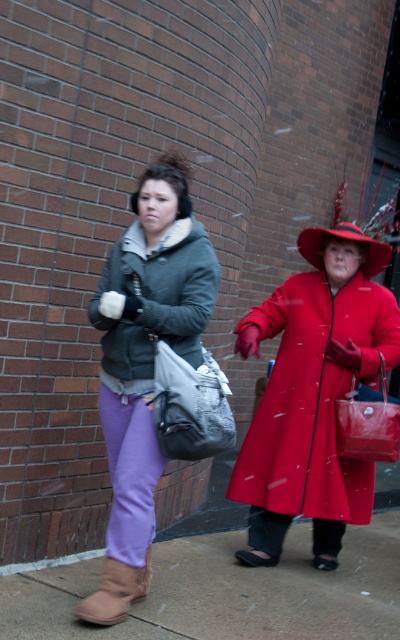
Question: Where is brown concrete sidewalk at lower center located in relation to matte red coat at center in the image?

Choices:
 (A) right
 (B) left

Answer: (B)

Question: Among these points, which one is nearest to the camera?

Choices:
 (A) (306, 253)
 (B) (146, 397)
 (C) (112, 570)
 (D) (381, 451)

Answer: (C)

Question: Which object is farther from the camera taking this photo?

Choices:
 (A) matte gray coat at center
 (B) matte gray jacket at center
 (C) brown concrete sidewalk at lower center
 (D) gray fabric shopping bag at center

Answer: (A)

Question: Can you confirm if gray fabric shopping bag at center is positioned to the left of red felt hat at center?

Choices:
 (A) yes
 (B) no

Answer: (A)

Question: Which of the following is the closest to the observer?

Choices:
 (A) matte gray jacket at center
 (B) matte gray coat at center

Answer: (A)

Question: Does brown concrete sidewalk at lower center appear over matte gray jacket at center?

Choices:
 (A) no
 (B) yes

Answer: (A)